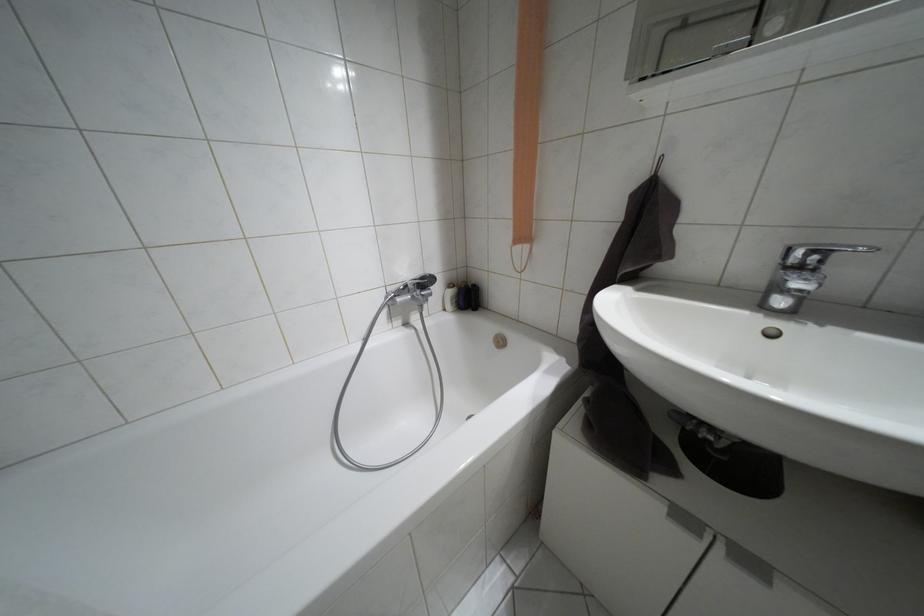
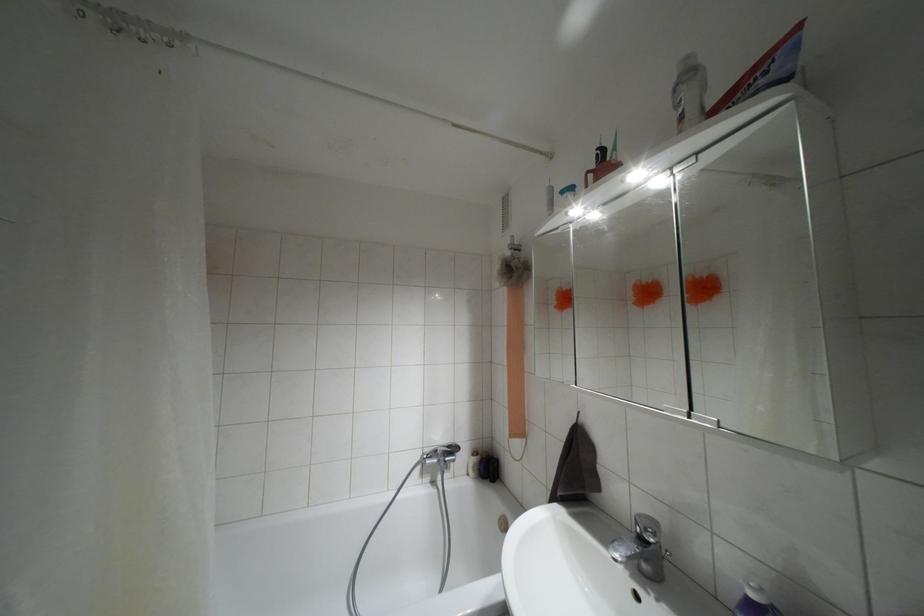
The point at (420, 277) is marked in the first image. Where is the corresponding point in the second image?

(447, 446)